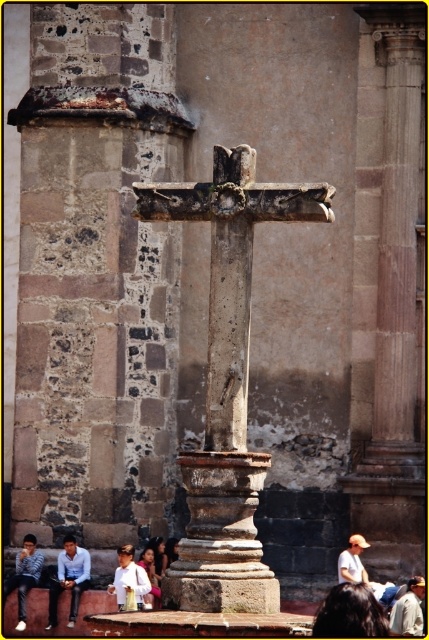
Question: Which of the following is the farthest from the observer?

Choices:
 (A) light brown leather hat at lower right
 (B) rusty stone cross at center
 (C) white cotton shirt at lower center
 (D) blue striped shirt at lower left

Answer: (D)

Question: Can you confirm if blue shirt at lower left is positioned above white cotton shirt at lower center?

Choices:
 (A) yes
 (B) no

Answer: (A)

Question: Which object is the closest to the light brown leather hat at center?

Choices:
 (A) blue shirt at lower left
 (B) white cotton shirt at lower center
 (C) light brown leather hat at lower right

Answer: (C)

Question: Which point is farther to the camera?

Choices:
 (A) (21, 547)
 (B) (63, 541)
 (C) (120, 592)
 (D) (160, 184)

Answer: (A)

Question: Can you confirm if rusty stone cross at center is positioned below blue striped shirt at lower left?

Choices:
 (A) no
 (B) yes

Answer: (A)

Question: Is blue shirt at lower left further to the viewer compared to blue striped shirt at lower left?

Choices:
 (A) no
 (B) yes

Answer: (B)